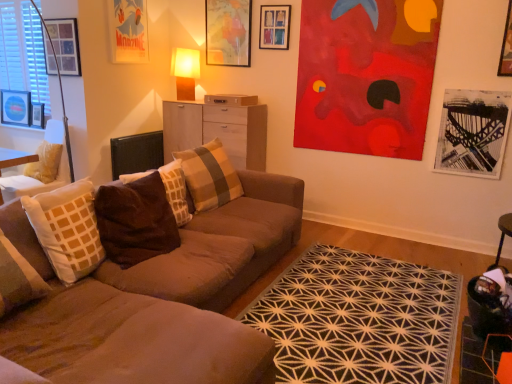
Question: Which direction should I rotate to face brown velvety pillow at center, acting as the 2th pillow starting from the front, — up or down?

Choices:
 (A) up
 (B) down

Answer: (B)

Question: Can you confirm if matte paper poster at upper left, which appears as the 4th picture frame when viewed from the right, is bigger than wooden picture frame at upper left, the sixth picture frame positioned from the right?

Choices:
 (A) yes
 (B) no

Answer: (A)

Question: Is there a large distance between matte paper poster at upper left, which appears as the 4th picture frame when viewed from the right, and wooden picture frame at upper left, placed as the 2th picture frame when sorted from left to right?

Choices:
 (A) no
 (B) yes

Answer: (B)

Question: Is matte paper poster at upper left, which appears as the 4th picture frame when viewed from the right, positioned before wooden picture frame at upper left, placed as the 2th picture frame when sorted from left to right?

Choices:
 (A) no
 (B) yes

Answer: (B)

Question: From a real-world perspective, is matte paper poster at upper left, which appears as the 4th picture frame when viewed from the right, under wooden picture frame at upper left, the sixth picture frame positioned from the right?

Choices:
 (A) no
 (B) yes

Answer: (A)

Question: Is matte paper poster at upper left, which appears as the 4th picture frame when viewed from the right, directly adjacent to wooden picture frame at upper left, the sixth picture frame positioned from the right?

Choices:
 (A) no
 (B) yes

Answer: (A)

Question: Can you confirm if matte paper poster at upper left, acting as the 4th picture frame starting from the left, is positioned to the left of wooden picture frame at upper left, the sixth picture frame positioned from the right?

Choices:
 (A) yes
 (B) no

Answer: (B)

Question: From a real-world perspective, is brushed metal picture frame at upper left, which ranks as the 7th picture frame in right-to-left order, positioned over matte paper poster at upper left, acting as the 4th picture frame starting from the left, based on gravity?

Choices:
 (A) no
 (B) yes

Answer: (A)

Question: Are brushed metal picture frame at upper left, which ranks as the 7th picture frame in right-to-left order, and matte paper poster at upper left, which appears as the 4th picture frame when viewed from the right, beside each other?

Choices:
 (A) yes
 (B) no

Answer: (B)

Question: Does brushed metal picture frame at upper left, which ranks as the 1th picture frame in left-to-right order, come in front of matte paper poster at upper left, acting as the 4th picture frame starting from the left?

Choices:
 (A) yes
 (B) no

Answer: (B)

Question: From the image's perspective, does brushed metal picture frame at upper left, which ranks as the 1th picture frame in left-to-right order, appear lower than matte paper poster at upper left, acting as the 4th picture frame starting from the left?

Choices:
 (A) no
 (B) yes

Answer: (B)

Question: Is brushed metal picture frame at upper left, which ranks as the 1th picture frame in left-to-right order, further to camera compared to matte paper poster at upper left, which appears as the 4th picture frame when viewed from the right?

Choices:
 (A) yes
 (B) no

Answer: (A)

Question: Is matte paper poster at upper left, acting as the 4th picture frame starting from the left, a part of brushed metal picture frame at upper left, which ranks as the 7th picture frame in right-to-left order?

Choices:
 (A) no
 (B) yes

Answer: (A)

Question: Is wooden picture frame at upper center, the sixth picture frame positioned from the left, shorter than velvet cushioned chair at left?

Choices:
 (A) no
 (B) yes

Answer: (B)